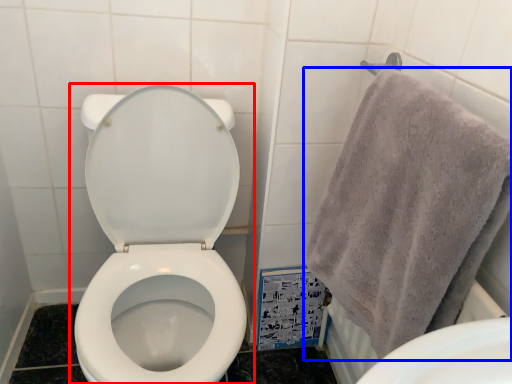
Question: Which of the following is the farthest to the observer, toilet (highlighted by a red box) or towel (highlighted by a blue box)?

Choices:
 (A) toilet
 (B) towel

Answer: (A)